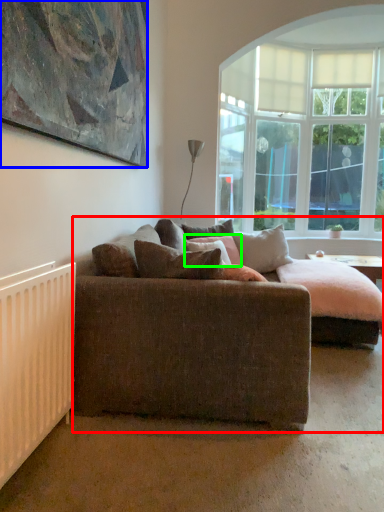
Question: Which object is the closest to the studio couch (highlighted by a red box)? Choose among these: picture frame (highlighted by a blue box) or pillow (highlighted by a green box).

Choices:
 (A) picture frame
 (B) pillow

Answer: (A)